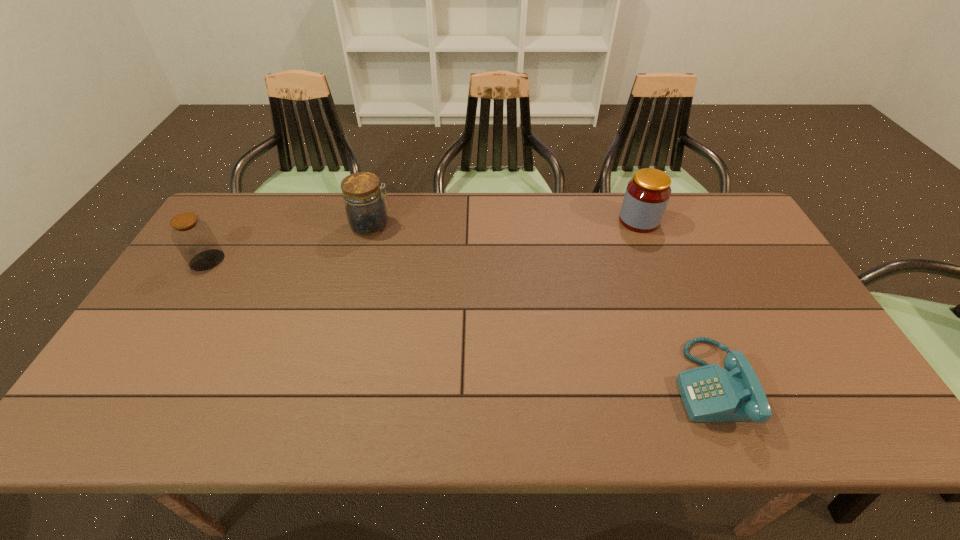
Image resolution: width=960 pixels, height=540 pixels. What are the coordinates of `vacant space located on the dial of the telephone` in the screenshot? It's located at (514, 383).

You are a GUI agent. You are given a task and a screenshot of the screen. Output one action in this format:
    pyautogui.click(x=<x>, y=<y>)
    Task: Click on the free space located 0.170m on the dial of the telephone
    
    Given the screenshot: What is the action you would take?
    pyautogui.click(x=603, y=383)

This screenshot has height=540, width=960. I want to click on object present at the near edge, so click(710, 393).

Where is `object located in the left edge section of the desktop`? This screenshot has width=960, height=540. object located in the left edge section of the desktop is located at coordinates (194, 239).

In the image, there is a desktop. At what (x,y) coordinates should I click in order to perform the action: click on free space at the far edge. Please return your answer as a coordinate pair (x, y). This screenshot has height=540, width=960. Looking at the image, I should click on (282, 232).

At what (x,y) coordinates should I click in order to perform the action: click on free region at the near edge of the desktop. Please return your answer as a coordinate pair (x, y). Looking at the image, I should click on (569, 407).

Where is `free space at the left edge`? This screenshot has width=960, height=540. free space at the left edge is located at coordinates (182, 319).

What are the coordinates of `vacant point at the right edge` in the screenshot? It's located at (756, 265).

Where is `free space at the far left corner of the desktop`? free space at the far left corner of the desktop is located at coordinates (252, 213).

This screenshot has width=960, height=540. In the image, there is a desktop. In order to click on vacant space at the near left corner in this screenshot , I will do `click(123, 417)`.